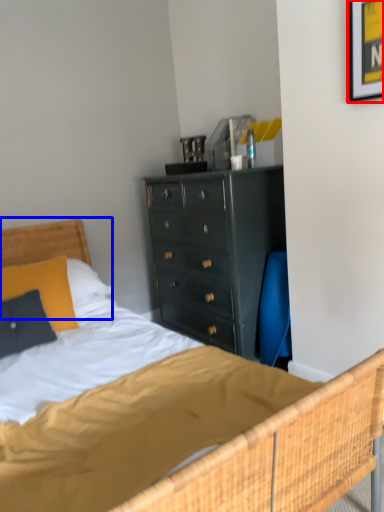
Question: Which point is closer to the camera, picture frame (highlighted by a red box) or headboard (highlighted by a blue box)?

Choices:
 (A) picture frame
 (B) headboard

Answer: (A)